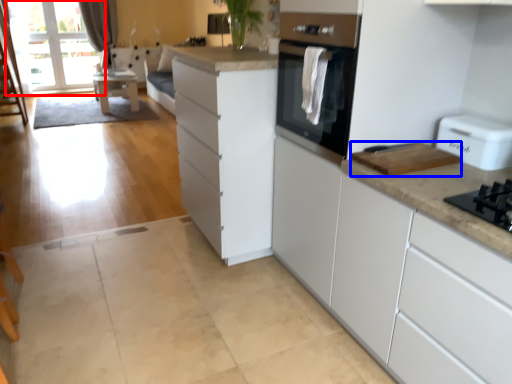
Question: Among these objects, which one is nearest to the camera, window screen (highlighted by a red box) or appliance (highlighted by a blue box)?

Choices:
 (A) window screen
 (B) appliance

Answer: (B)